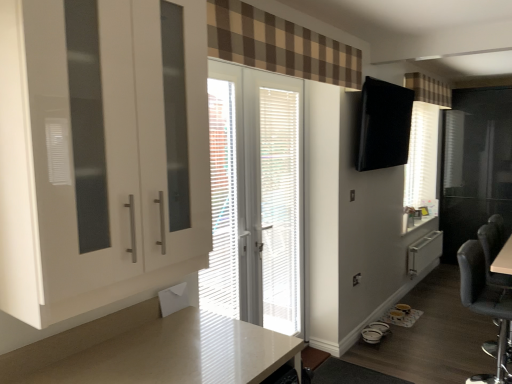
The image size is (512, 384). I want to click on free space to the left of black fabric chair at lower right, so click(x=426, y=372).